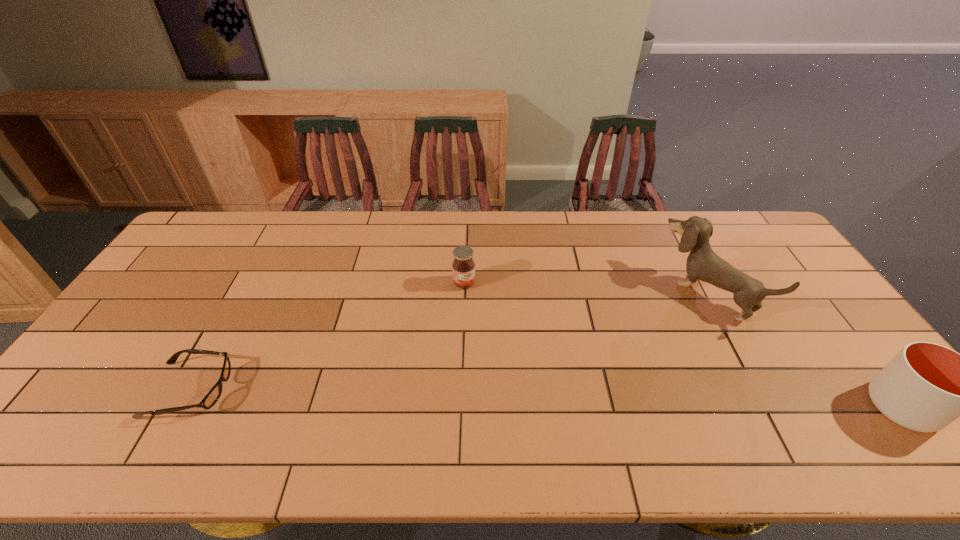
Where is `free space between the spectacles and the puppy`? The image size is (960, 540). free space between the spectacles and the puppy is located at coordinates (448, 341).

Where is `free space between the third shortest object and the jam`? The image size is (960, 540). free space between the third shortest object and the jam is located at coordinates (683, 345).

At what (x,y) coordinates should I click in order to perform the action: click on free space between the cup and the puppy. Please return your answer as a coordinate pair (x, y). Looking at the image, I should click on [804, 350].

In order to click on vacant area between the jam and the second tallest object in this screenshot , I will do `click(683, 345)`.

I want to click on empty space between the third shortest object and the second object from left to right, so click(x=683, y=345).

Locate an element on the screen. Image resolution: width=960 pixels, height=540 pixels. vacant region between the cup and the third object from right to left is located at coordinates (x=683, y=345).

Select which object is the closest to the tallest object. Please provide its 2D coordinates. Your answer should be formatted as a tuple, i.e. [(x, y)], where the tuple contains the x and y coordinates of a point satisfying the conditions above.

[(925, 387)]

Select which object appears as the second closest to the puppy. Please provide its 2D coordinates. Your answer should be formatted as a tuple, i.e. [(x, y)], where the tuple contains the x and y coordinates of a point satisfying the conditions above.

[(463, 267)]

Image resolution: width=960 pixels, height=540 pixels. Identify the location of vacant region that satisfies the following two spatial constraints: 1. on the front side of the third object from right to left; 2. on the left side of the third shortest object. (460, 407).